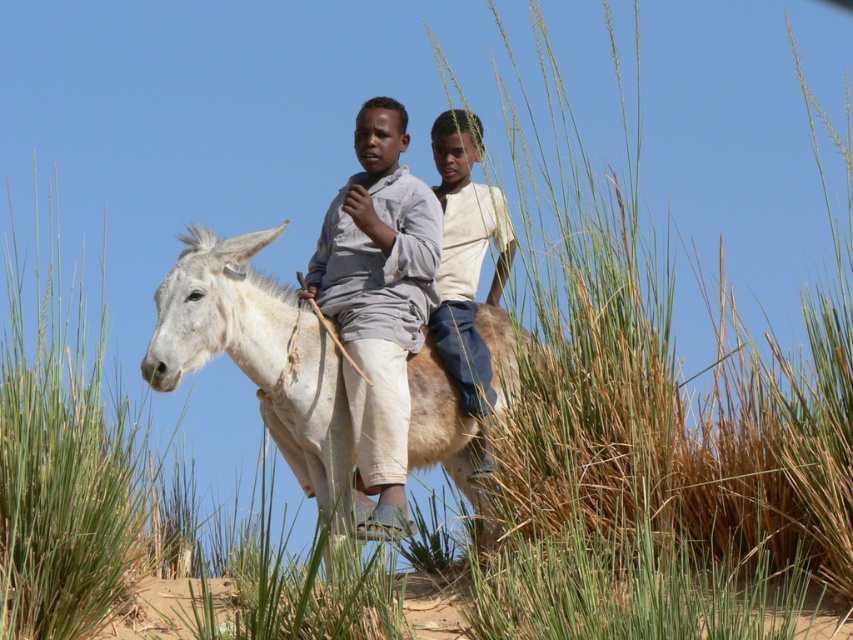
Looking at this image, you are a photographer trying to capture the white matte mule at center in your shot. The camera you are using has a rectangular viewfinder with coordinates ranging from 0 to 1 on both the x and y axes. The mule is positioned at point 0.556, 0.304. To ensure the mule is centered in your photo, where should you adjust the camera focus point to?

The white matte mule at center is already positioned at point (258, 355). To center it in the viewfinder, adjust the focus point to the center coordinates of the viewfinder, which is (426, 320). This will align the mule at the center of the frame.

You are standing on the path and see two boys riding a donkey. One is wearing a light gray cotton shirt at center and the other a light brown cotton shirt at center. Which boy is closer to you?

The light gray cotton shirt at center is closer to the viewer than the light brown cotton shirt at center, so the boy wearing the light gray cotton shirt at center is closer to you.

You are a photographer trying to capture a photo of the two boys riding the donkey. You want to ensure both the white matte mule at center and the light gray cotton shirt at center are clearly visible in the frame. Based on their positions, which object should you focus on first to ensure both are in focus?

The white matte mule at center is to the left of the light gray cotton shirt at center. Since the mule is further left, you should focus on the white matte mule at center first to ensure both are in focus as they are aligned horizontally.